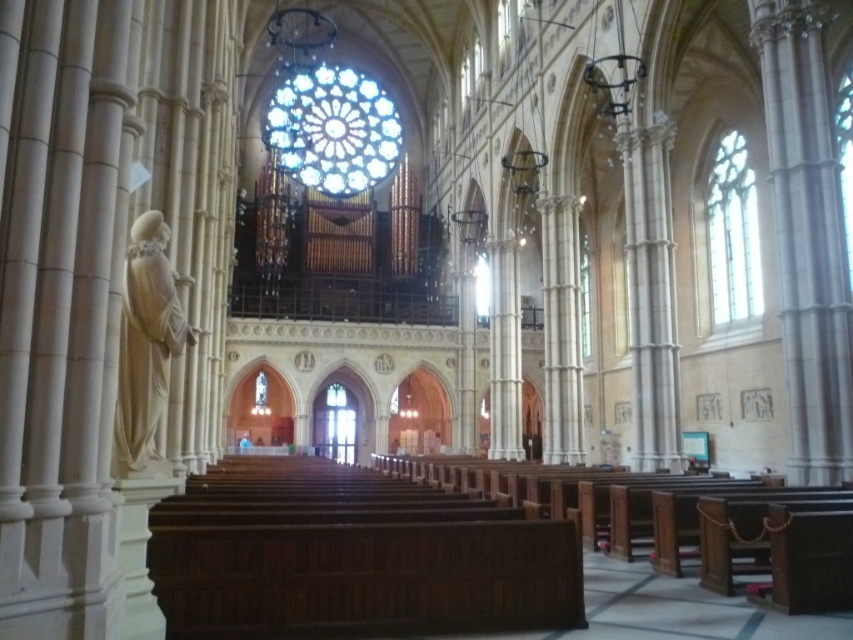
Is stained glass window at center smaller than clear glass window at right?

Actually, stained glass window at center might be larger than clear glass window at right.

Is stained glass window at center positioned in front of clear glass window at right?

No, stained glass window at center is behind clear glass window at right.

Identify the location of stained glass window at center. (334, 129).